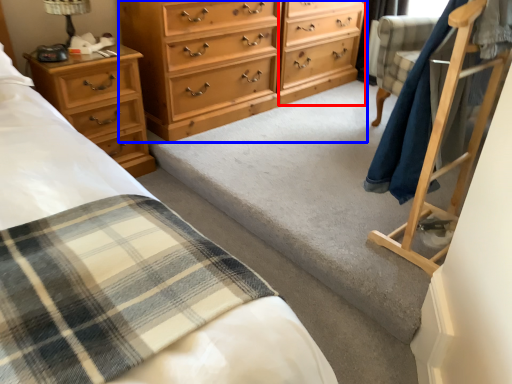
Question: Which point is further to the camera, file cabinet (highlighted by a red box) or chest of drawers (highlighted by a blue box)?

Choices:
 (A) file cabinet
 (B) chest of drawers

Answer: (A)